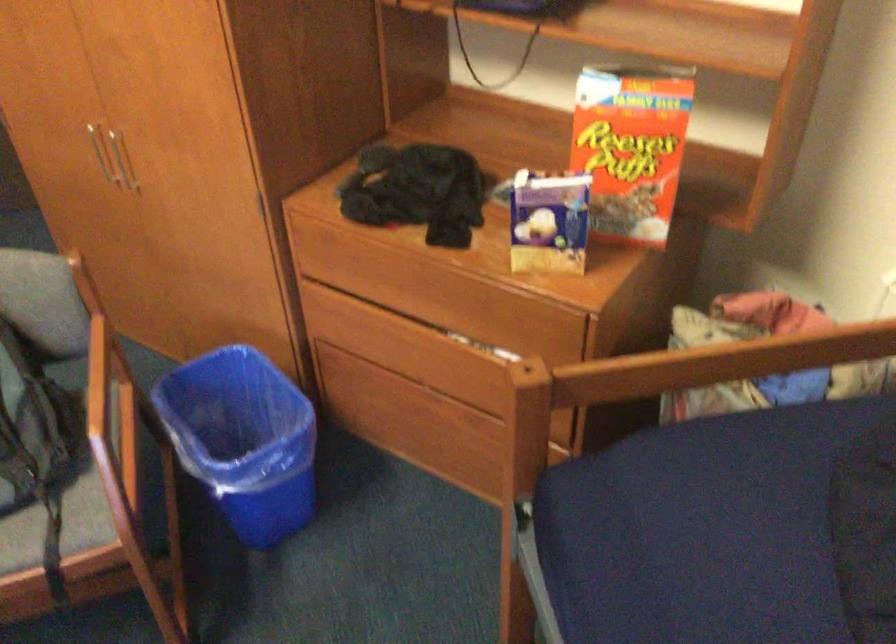
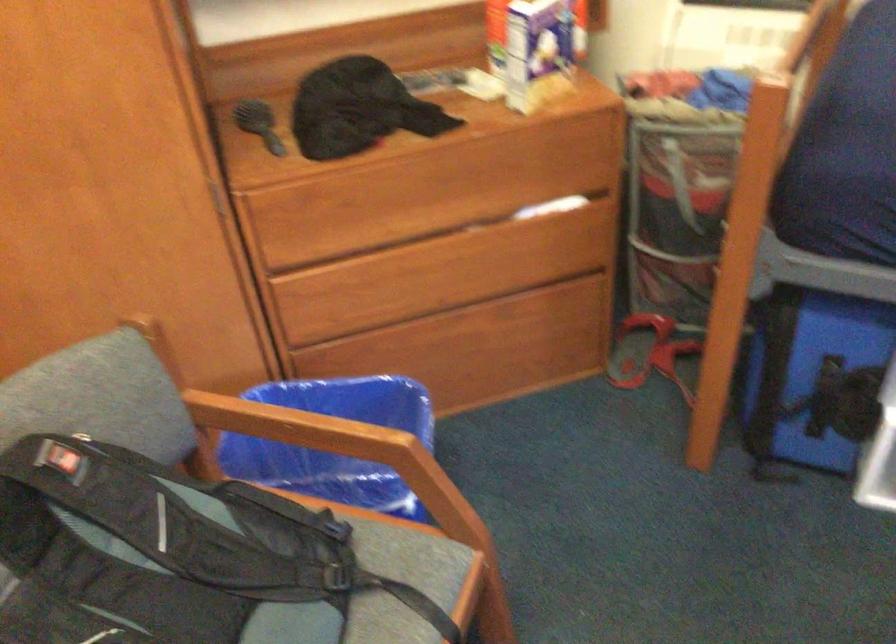
Locate, in the second image, the point that corresponds to (x=115, y=411) in the first image.

(334, 440)